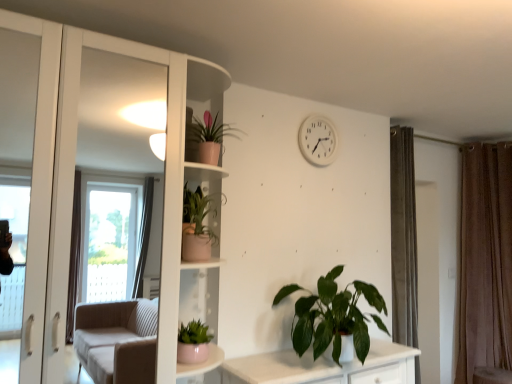
Question: Can you confirm if green matte plant at lower center, which ranks as the 1th houseplant in right-to-left order, is smaller than matte pink pot at lower center, which is counted as the 1th houseplant, starting from the left?

Choices:
 (A) no
 (B) yes

Answer: (A)

Question: Is there a large distance between green matte plant at lower center, acting as the 4th houseplant starting from the top, and matte pink pot at lower center, acting as the second houseplant starting from the bottom?

Choices:
 (A) no
 (B) yes

Answer: (A)

Question: Does green matte plant at lower center, the fourth houseplant from the left, come behind matte pink pot at lower center, placed as the 4th houseplant when sorted from right to left?

Choices:
 (A) yes
 (B) no

Answer: (A)

Question: From a real-world perspective, is green matte plant at lower center, the fourth houseplant from the left, physically below matte pink pot at lower center, which is counted as the 1th houseplant, starting from the left?

Choices:
 (A) yes
 (B) no

Answer: (B)

Question: Does green matte plant at lower center, acting as the 4th houseplant starting from the top, have a greater width compared to matte pink pot at lower center, which is counted as the 1th houseplant, starting from the left?

Choices:
 (A) yes
 (B) no

Answer: (A)

Question: In the image, is matte pink pot at center-left, the 3th houseplant in the right-to-left sequence, positioned in front of or behind green matte plant at lower center, acting as the 4th houseplant starting from the top?

Choices:
 (A) front
 (B) behind

Answer: (A)

Question: Looking at their shapes, would you say matte pink pot at center-left, which is the second houseplant in left-to-right order, is wider or thinner than green matte plant at lower center, the fourth houseplant from the left?

Choices:
 (A) thin
 (B) wide

Answer: (A)

Question: Considering the positions of matte pink pot at center-left, the second houseplant viewed from the top, and green matte plant at lower center, the fourth houseplant from the left, in the image, is matte pink pot at center-left, the second houseplant viewed from the top, taller or shorter than green matte plant at lower center, the fourth houseplant from the left,?

Choices:
 (A) short
 (B) tall

Answer: (A)

Question: Is matte pink pot at center-left, the 3th houseplant in the right-to-left sequence, bigger or smaller than green matte plant at lower center, which ranks as the 1th houseplant in right-to-left order?

Choices:
 (A) big
 (B) small

Answer: (B)

Question: Would you say white plastic clock at upper center is to the left or to the right of pink matte pot at upper center, the second houseplant viewed from the right, in the picture?

Choices:
 (A) left
 (B) right

Answer: (B)

Question: Considering the positions of white plastic clock at upper center and pink matte pot at upper center, which appears as the third houseplant when viewed from the left, in the image, is white plastic clock at upper center wider or thinner than pink matte pot at upper center, which appears as the third houseplant when viewed from the left,?

Choices:
 (A) thin
 (B) wide

Answer: (A)

Question: Is white plastic clock at upper center situated inside pink matte pot at upper center, the first houseplant viewed from the top, or outside?

Choices:
 (A) outside
 (B) inside

Answer: (A)

Question: From the image's perspective, relative to pink matte pot at upper center, the second houseplant viewed from the right, is white plastic clock at upper center above or below?

Choices:
 (A) below
 (B) above

Answer: (B)

Question: From the image's perspective, relative to matte pink pot at center-left, the 3th houseplant in the right-to-left sequence, is matte pink pot at lower center, acting as the second houseplant starting from the bottom, above or below?

Choices:
 (A) below
 (B) above

Answer: (A)

Question: Would you say matte pink pot at lower center, placed as the 4th houseplant when sorted from right to left, is to the left or to the right of matte pink pot at center-left, the third houseplant positioned from the bottom, in the picture?

Choices:
 (A) right
 (B) left

Answer: (B)